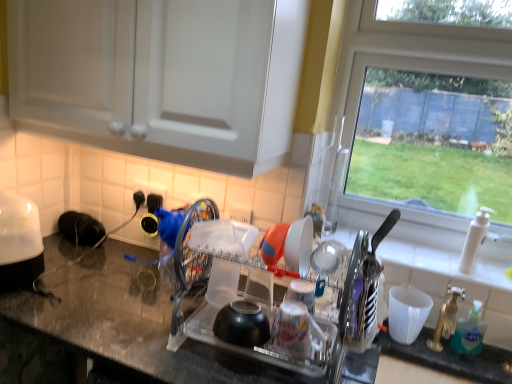
Identify the location of free point to the right of white glossy toaster at left. pyautogui.click(x=51, y=298).